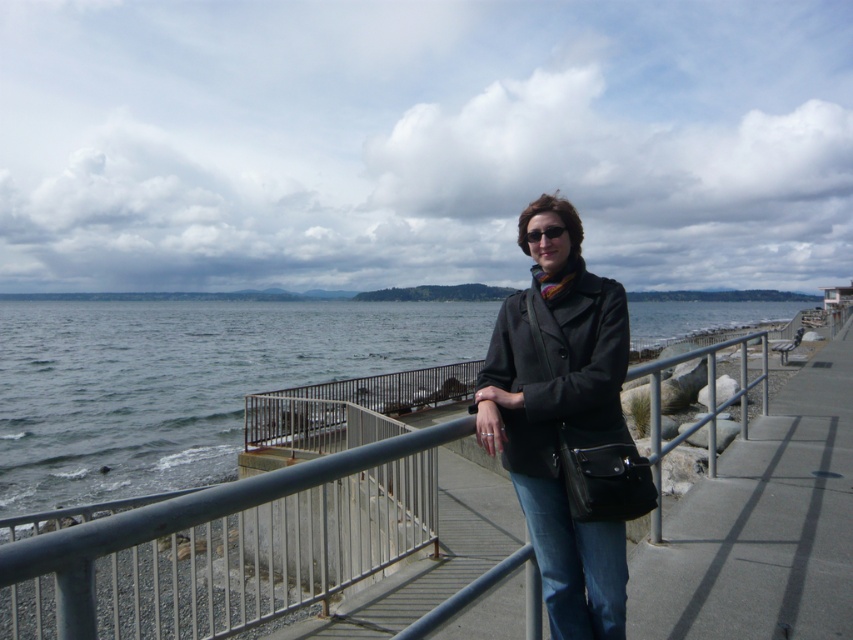
Question: Among these objects, which one is farthest from the camera?

Choices:
 (A) black matte coat at center
 (B) multicolored knitted scarf at center
 (C) metallic gray railing at center
 (D) matte black coat at center

Answer: (B)

Question: Is metallic gray railing at center to the left of matte black coat at center from the viewer's perspective?

Choices:
 (A) yes
 (B) no

Answer: (A)

Question: Is metallic gray railing at center to the left of black matte coat at center from the viewer's perspective?

Choices:
 (A) no
 (B) yes

Answer: (B)

Question: Which point is closer to the camera taking this photo?

Choices:
 (A) (572, 616)
 (B) (587, 298)
 (C) (544, 272)

Answer: (B)

Question: Does black matte coat at center have a smaller size compared to multicolored knitted scarf at center?

Choices:
 (A) no
 (B) yes

Answer: (A)

Question: Which point is farther from the camera taking this photo?

Choices:
 (A) (573, 308)
 (B) (558, 289)
 (C) (488, 436)
 (D) (602, 595)

Answer: (B)